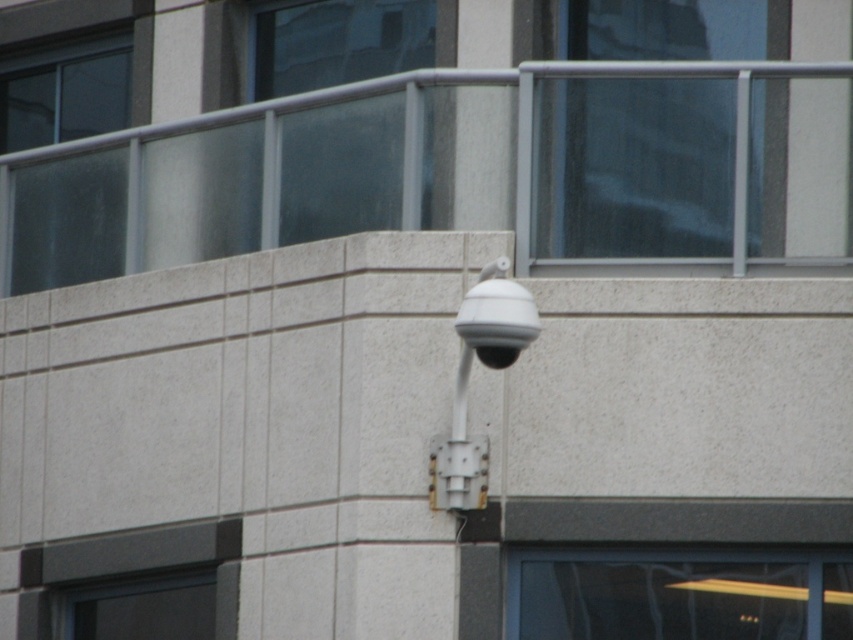
You are standing at the point labeled point (611, 248) and want to move to the point labeled point (39, 134). Given that the camera has a 90 degree field of view, will your path be visible to the camera?

Yes, because point (611, 248) is closer to the camera than point (39, 134), so the path between them would be within the camera 90 degree field of view.

Consider the image. You are a window installer checking the dimensions of the transparent glass window at upper left and the transparent glass at upper center. Which one is taller?

The transparent glass window at upper left is taller than the transparent glass at upper center.